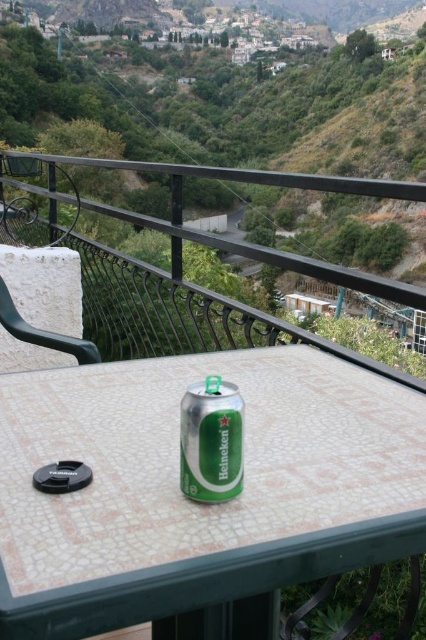
You are standing on a balcony overlooking a valley. There is a point at coordinates point (89,628). If you want to place a 1.5 meter long ladder from your current position to that point, will it be long enough to reach?

The distance between you and point (89,628) is 1.37 meters. Since the ladder is 1.5 meters long, it will be long enough to reach the point.

You are standing on the balcony and want to reach the point marked at coordinates (201, 499). Can you safely step forward from your current position to that point without falling over the railing?

The distance between you and the point at coordinates (201, 499) is 1.72 meters. Since this distance is greater than the typical safe stepping distance, stepping forward might lead to an unsafe situation. It is recommended to not attempt this move.

You are a delivery robot with a 3.5 feet wide package. You need to move from the metallic green can at center to the green plastic chair at upper left. Is there enough space between them for your package?

The distance between the metallic green can at center and the green plastic chair at upper left is 4.59 feet. Since the package is 3.5 feet wide, there is sufficient space for the delivery robot to maneuver the package between them.